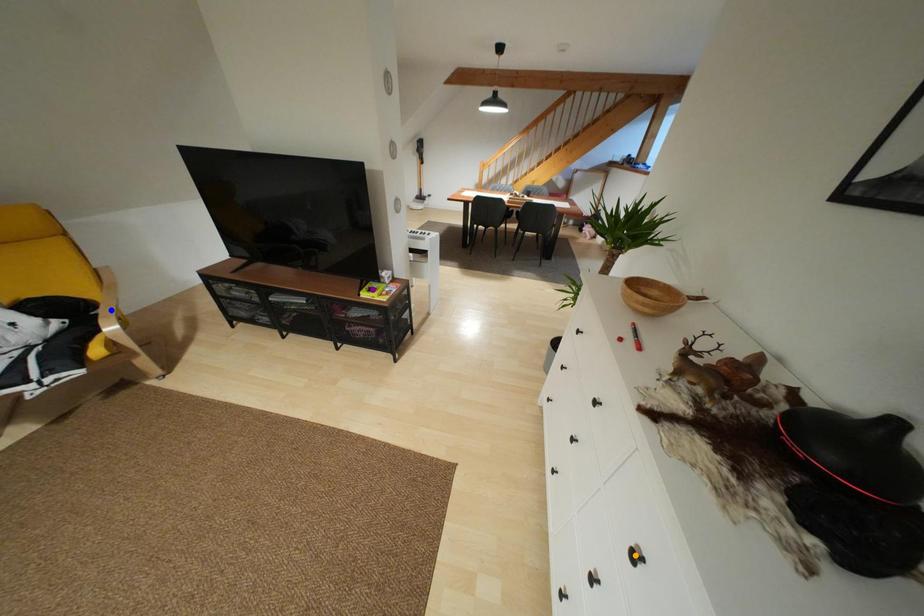
Order these from nearest to farthest:
- orange point
- blue point
- purple point

orange point, blue point, purple point